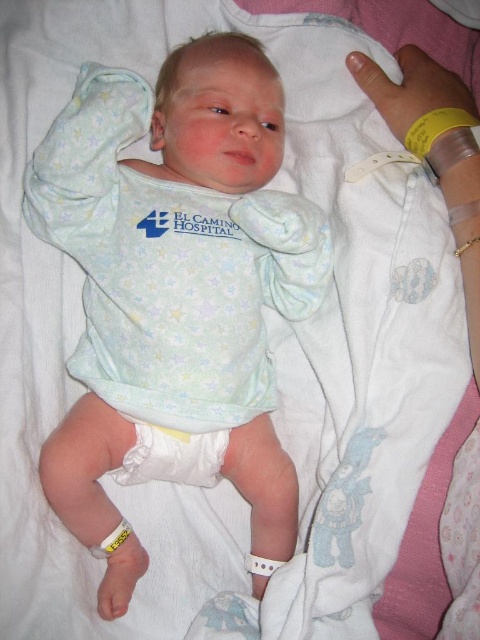
Question: Observing the image, what is the correct spatial positioning of white soft fabric baby at center in reference to white soft diaper at center?

Choices:
 (A) above
 (B) below

Answer: (A)

Question: Among these points, which one is farthest from the camera?

Choices:
 (A) (269, 406)
 (B) (216, 451)

Answer: (A)

Question: Which point is closer to the camera?

Choices:
 (A) white soft fabric baby at center
 (B) white soft diaper at center

Answer: (A)

Question: Is white soft fabric baby at center behind white soft diaper at center?

Choices:
 (A) no
 (B) yes

Answer: (A)

Question: Is white soft fabric baby at center to the right of white soft diaper at center from the viewer's perspective?

Choices:
 (A) no
 (B) yes

Answer: (B)

Question: Which of the following is the closest to the observer?

Choices:
 (A) white soft fabric baby at center
 (B) white soft diaper at center

Answer: (A)